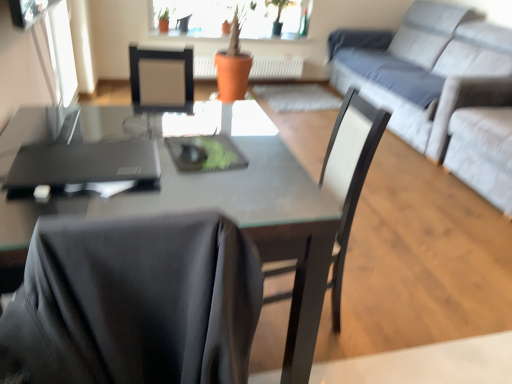
This screenshot has width=512, height=384. Find the location of `free location in front of black matte laptop at left`. free location in front of black matte laptop at left is located at coordinates (64, 202).